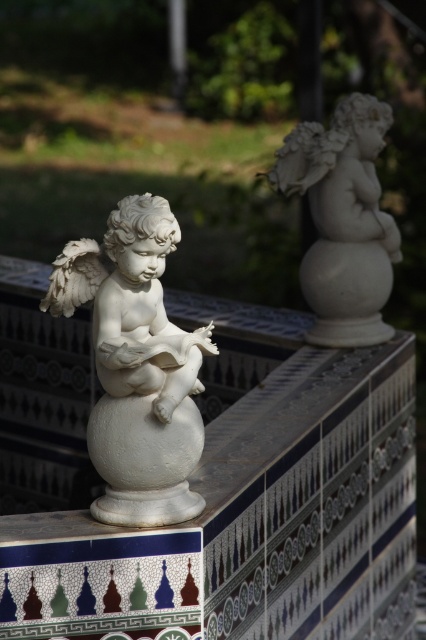
You are a painter standing at the edge of the ledge where the white marble cherub at center is placed. You want to paint both cherubs without moving. Can you reach the other cherub that is 8.34 feet away with your 10 foot long paintbrush?

The distance between the two cherubs is 8.34 feet, and your paintbrush is 10 feet long, so yes, you can reach the other cherub that is 8.34 feet away with your 10 foot long paintbrush.

You are standing in front of the decorative tiled ledge with two white marble cherub statues. You want to place a small potted plant between them. Given that the potted plant requires 0.5 meters of space to fit comfortably, will there be enough space between the white marble cherub at center and the white marble cherub at upper right?

The white marble cherub at center is 1.17 meters away from the white marble cherub at upper right. Since the required space for the potted plant is 0.5 meters, there is sufficient space between them to place the plant comfortably.

You are an art curator planning to display two white marble cherub statues in a gallery. The first is the white marble cherub at center, and the second is the white marble cherub at upper right. Based on their sizes, which one would require more space for proper display?

The white marble cherub at upper right requires more space for proper display because it is larger in size compared to the white marble cherub at center.